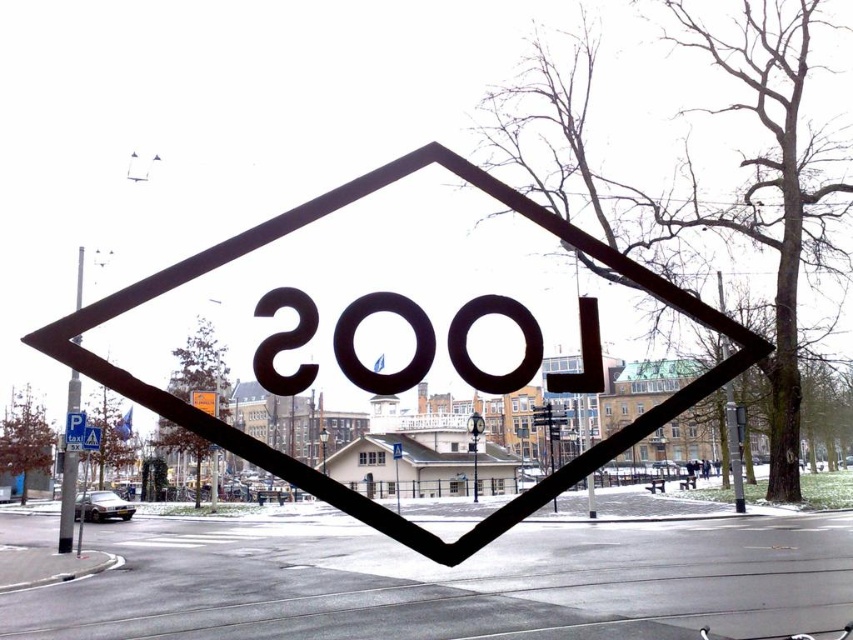
You are standing in front of the sculpture and want to read both the metallic sign at center and the black matte number at center. Which object should you look at first to the left?

You should look at the black matte number at center first because the metallic sign at center is to the right of it.

You are standing in front of the sculpture and want to read the black matte number at center. Is the metallic sign at center blocking your view of it?

The metallic sign at center is closer to the viewer than the black matte number at center, so the metallic sign at center is blocking the view of the black matte number at center.

You are a city planner assessing the visibility of the metallic pole at left and the black matte sign at center in the plaza. Which object is taller?

The metallic pole at left is taller than the black matte sign at center.